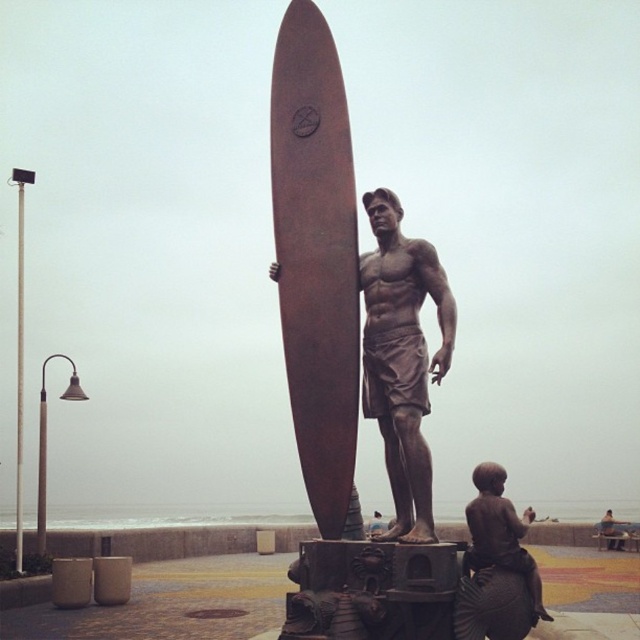
You are a photographer trying to capture the rusty brown surfboard at center in your shot. The statue is mounted on a pedestal with intricate carvings. Where exactly is the rusty brown surfboard positioned relative to the statue and the pedestal?

The rusty brown surfboard at center is located at point coordinates 0.409 on the x axis and 0.495 on the y axis relative to the statue and pedestal.

You are a sculptor planning to create a miniature version of the bronze statue at center and the rusty brown surfboard at center for a museum display. If you want the surfboard to be proportionally smaller than the statue in the miniature, should you reduce the surfboard more than the statue?

The rusty brown surfboard at center has a larger size compared to bronze statue at center. To make the surfboard proportionally smaller in the miniature, you should reduce the surfboard more than the statue so that the size relationship between them remains consistent.

You are a photographer planning to take a picture of the bronze statue and the rusty brown surfboard at center. The coordinates of the surfboard are given as point [316,260]. If your camera requires the surfboard to be centered precisely at point 0.5, 0.5 to capture the statue and surfboard symmetrically, how far off is the surfboard from the desired center point?

The rusty brown surfboard at center is located at point [316,260]. To determine how far it is from the desired center point 0.5, 0.5, we calculate the distance between these two coordinates. The horizontal distance is 0.5 minus 0.409 equals 0.091 units, and the vertical distance is 0.5 minus 0.495 equals 0.005 units. Therefore, the surfboard is approximately 0.091 units to the left and 0.005 units below the desired center point.